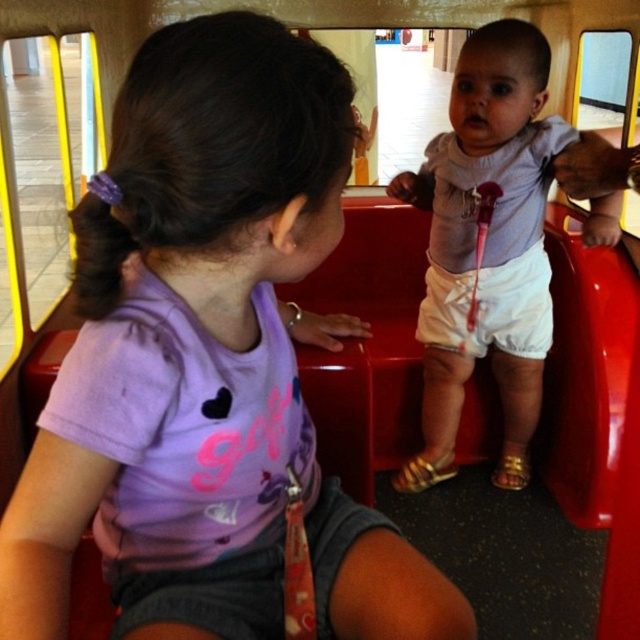
You are designing a new outfit for a child and need to ensure that the purple matte shirt at upper left and white cotton shorts at center will fit together. Given their sizes, which item is narrower?

The purple matte shirt at upper left is narrower than the white cotton shorts at center, so they can be worn together without issues.

You are standing in the play area and need to locate the purple matte shirt at upper left. According to the coordinates provided, where exactly is it positioned?

The purple matte shirt at upper left is located at point coordinates 0.566 on the x axis and 0.325 on the y axis.